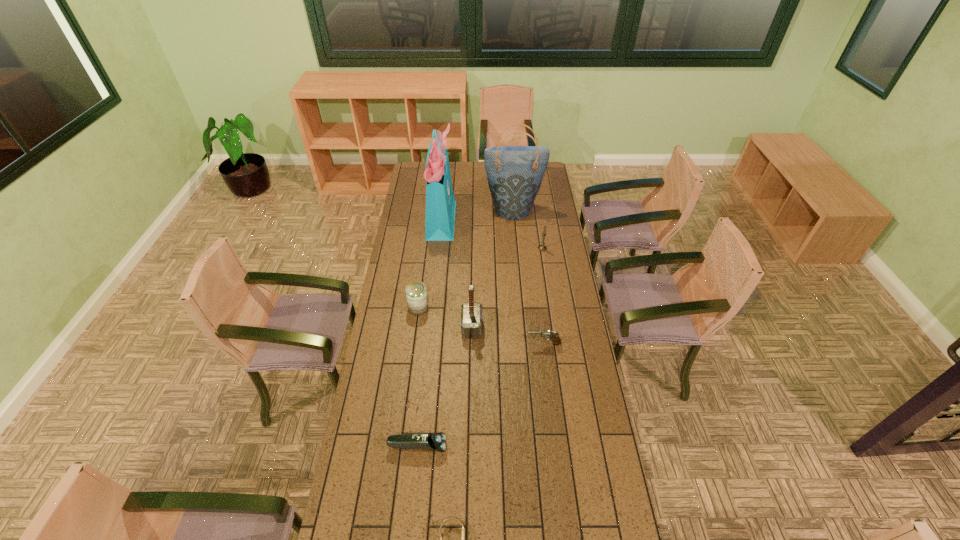
Find the location of `vacant space located 0.100m on the back of the left shopping bag`. vacant space located 0.100m on the back of the left shopping bag is located at coordinates (444, 190).

The height and width of the screenshot is (540, 960). I want to click on vacant position located 0.380m on the left of the right shopping bag, so point(418,208).

Find the location of a particular element. The width and height of the screenshot is (960, 540). free space located 0.090m on the front of the hammer is located at coordinates (471, 357).

This screenshot has height=540, width=960. Find the location of `vacant space situated on the back of the fourth tallest object`. vacant space situated on the back of the fourth tallest object is located at coordinates (539, 226).

In order to click on vacant space located on the front of the fourth shortest object in this screenshot , I will do `click(414, 341)`.

You are a GUI agent. You are given a task and a screenshot of the screen. Output one action in this format:
    pyautogui.click(x=<x>, y=<y>)
    Task: Click on the free space located 0.260m at the barrel of the sixth farthest object
    Image resolution: width=960 pixels, height=540 pixels.
    Given the screenshot: What is the action you would take?
    (x=467, y=344)

The image size is (960, 540). I want to click on vacant space situated at the barrel of the sixth farthest object, so click(x=483, y=344).

Find the location of a particular element. vacant space located at the barrel of the sixth farthest object is located at coordinates (514, 344).

Locate an element on the screen. This screenshot has height=540, width=960. free space located 0.120m on the head of the seventh farthest object is located at coordinates (481, 447).

The image size is (960, 540). Find the location of `shopping bag at the left edge`. shopping bag at the left edge is located at coordinates (440, 203).